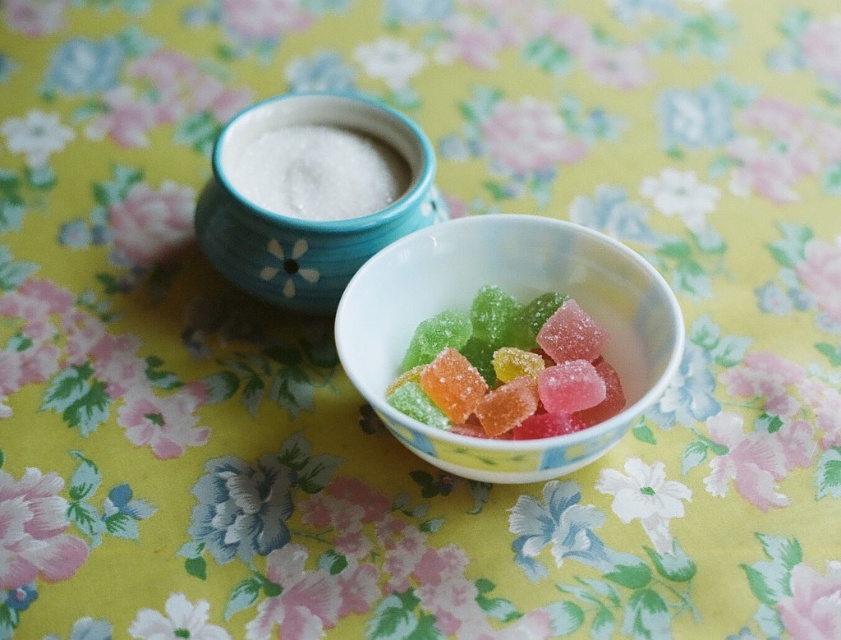
You are arranging a dessert table and need to place a decorative item between the porcelain bowl at center and the white granular sugar at upper center. Based on their positions, where should you place the item to ensure it is between them?

The porcelain bowl at center is located below the white granular sugar at upper center, so placing the decorative item between them would require positioning it above the porcelain bowl at center and below the white granular sugar at upper center.